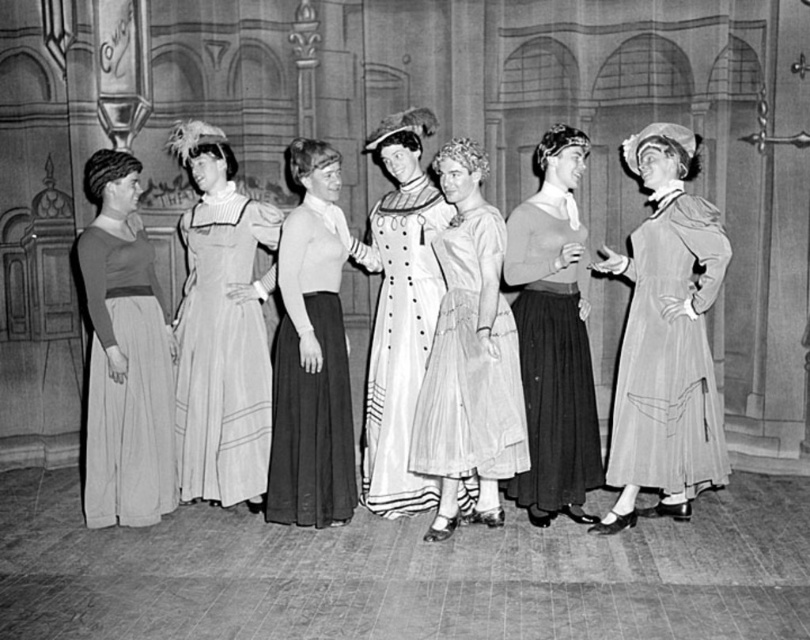
The height and width of the screenshot is (640, 810). I want to click on silky gray dress at center, so click(664, 339).

Is silky gray dress at center below matte black dress at left?

Incorrect, silky gray dress at center is not positioned below matte black dress at left.

Is point (634, 433) behind point (168, 499)?

No, (634, 433) is closer to viewer.

Image resolution: width=810 pixels, height=640 pixels. I want to click on silky gray dress at center, so click(x=664, y=339).

Who is positioned more to the left, matte white dress at center or white satin dress at center?

white satin dress at center is more to the left.

Measure the distance between matte white dress at center and white satin dress at center.

The distance of matte white dress at center from white satin dress at center is 24.18 inches.

Who is more distant from viewer, (548, 413) or (380, 385)?

Point (380, 385)

Find the location of a particular element. Image resolution: width=810 pixels, height=640 pixels. matte white dress at center is located at coordinates click(x=553, y=333).

Is silky gray dress at center to the right of matte white dress at center from the viewer's perspective?

Yes, silky gray dress at center is to the right of matte white dress at center.

From the picture: Can you confirm if silky gray dress at center is positioned above matte white dress at center?

Actually, silky gray dress at center is below matte white dress at center.

Is point (681, 188) behind point (531, 198)?

No, (681, 188) is closer to viewer.

Identify the location of silky gray dress at center. This screenshot has height=640, width=810. (664, 339).